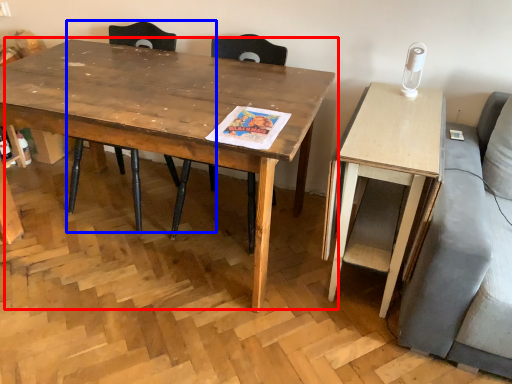
Question: Which of the following is the closest to the observer, coffee table (highlighted by a red box) or chair (highlighted by a blue box)?

Choices:
 (A) coffee table
 (B) chair

Answer: (A)